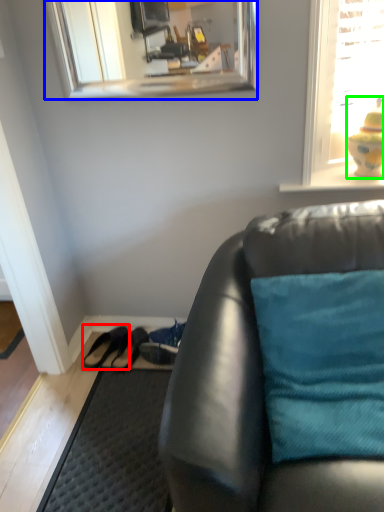
Question: Estimate the real-world distances between objects in this image. Which object is farther from shoe (highlighted by a red box), mirror (highlighted by a blue box) or toy (highlighted by a green box)?

Choices:
 (A) mirror
 (B) toy

Answer: (A)